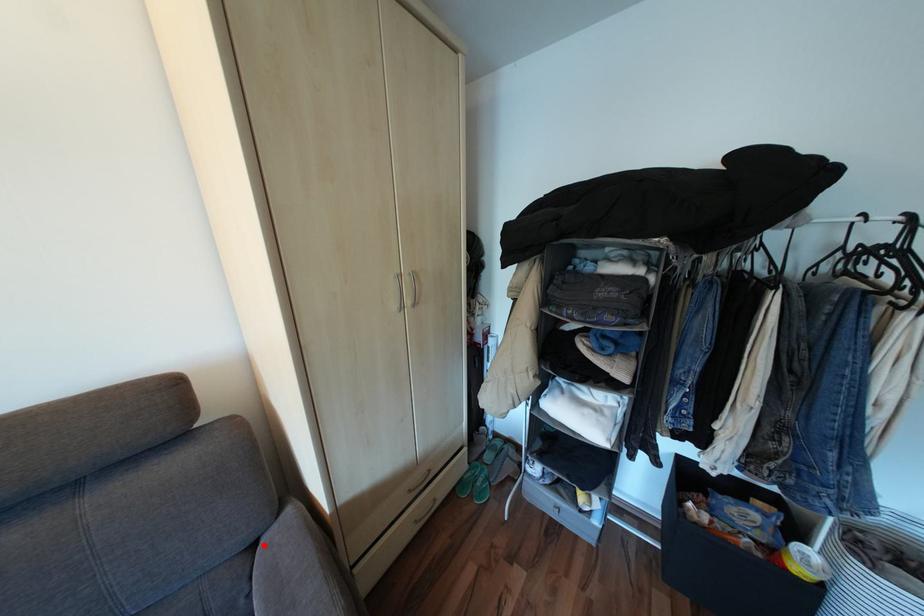
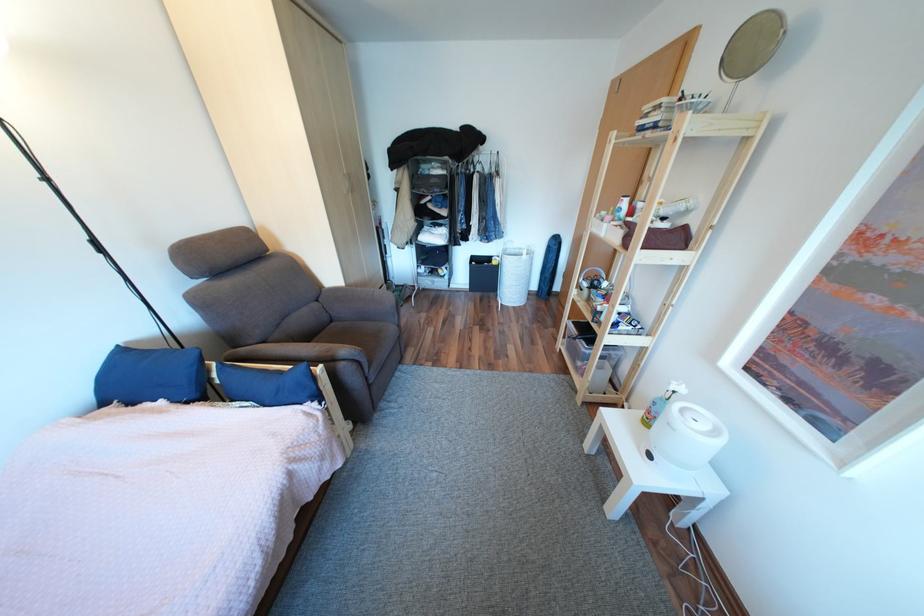
Find the pixel in the second image that matches the highlighted location in the first image.

(329, 301)